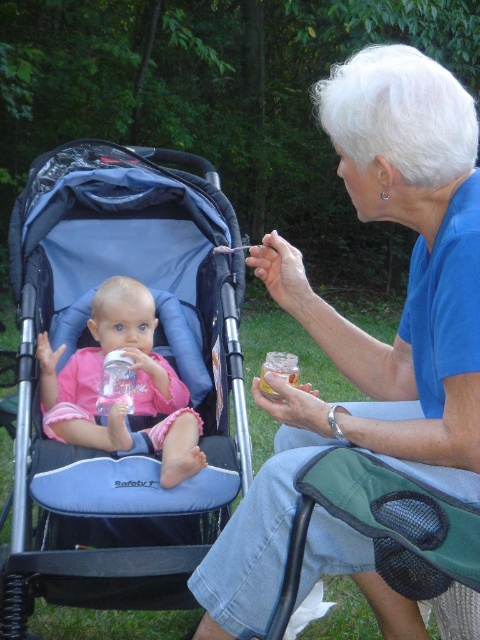
Question: Is blue fabric stroller at upper left to the left of clear plastic bottle at left from the viewer's perspective?

Choices:
 (A) no
 (B) yes

Answer: (A)

Question: Observing the image, what is the correct spatial positioning of blue fabric stroller at upper left in reference to pink fabric baby at center?

Choices:
 (A) right
 (B) left

Answer: (A)

Question: Estimate the real-world distances between objects in this image. Which object is closer to the clear plastic bottle at left?

Choices:
 (A) pink fabric baby at center
 (B) blue fabric stroller at upper left
 (C) blue fabric stroller at left

Answer: (A)

Question: Which point is farther from the camera taking this photo?

Choices:
 (A) (84, 380)
 (B) (129, 404)

Answer: (A)

Question: Which object is closer to the camera taking this photo?

Choices:
 (A) pink fabric baby at center
 (B) clear plastic bottle at left
 (C) blue fabric stroller at upper left
 (D) blue fabric stroller at left

Answer: (C)

Question: Is blue fabric stroller at left wider than pink fabric baby at center?

Choices:
 (A) yes
 (B) no

Answer: (A)